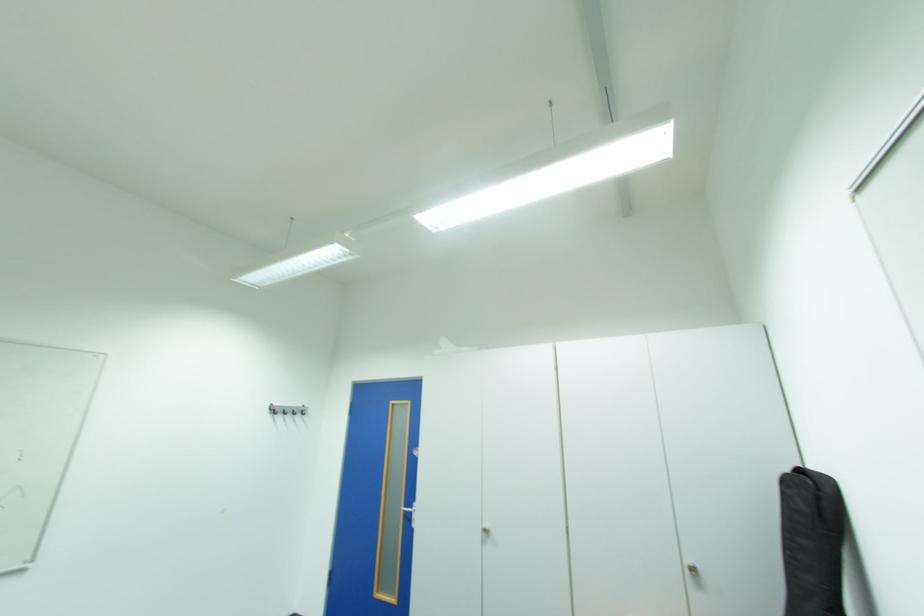
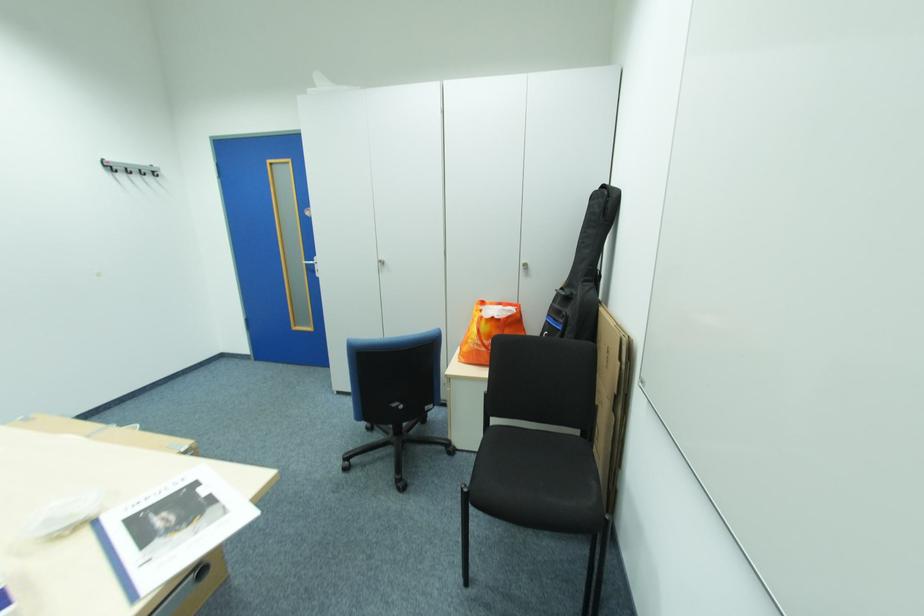
Question: I am providing you with two images of the same scene from different viewpoints. Which of the following objects are not visible in image2?

Choices:
 (A) folded cardboard
 (B) silver door handle
 (C) black chair sitting surface
 (D) none of these

Answer: (D)